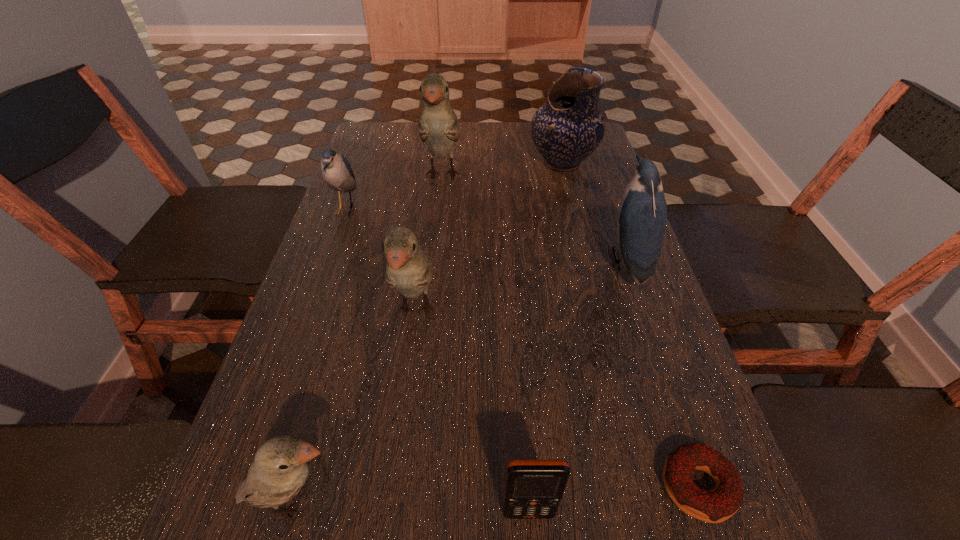
At what (x,y) coordinates should I click in order to perform the action: click on free spot between the fifth object from left to right and the tallest object. Please return your answer as a coordinate pair (x, y). This screenshot has width=960, height=540. Looking at the image, I should click on (486, 343).

Find the location of a particular element. The image size is (960, 540). unoccupied area between the second farthest white bird and the cellular telephone is located at coordinates (472, 411).

Point out which object is positioned as the nearest to the shortest object. Please provide its 2D coordinates. Your answer should be formatted as a tuple, i.e. [(x, y)], where the tuple contains the x and y coordinates of a point satisfying the conditions above.

[(534, 487)]

Where is `object that stands as the sixth closest to the nearest white bird`? The image size is (960, 540). object that stands as the sixth closest to the nearest white bird is located at coordinates (438, 127).

You are a GUI agent. You are given a task and a screenshot of the screen. Output one action in this format:
    pyautogui.click(x=<x>, y=<y>)
    Task: Click on the bird that is the third closest to the pottery
    This screenshot has height=540, width=960.
    Given the screenshot: What is the action you would take?
    pyautogui.click(x=409, y=269)

Identify the location of the second closest bird to the smallest white bird. This screenshot has height=540, width=960. (337, 172).

The image size is (960, 540). Identify the location of the third closest white bird to the left blue bird. (280, 468).

Select which white bird appears as the second closest to the shortest object. Please provide its 2D coordinates. Your answer should be formatted as a tuple, i.e. [(x, y)], where the tuple contains the x and y coordinates of a point satisfying the conditions above.

[(280, 468)]

The image size is (960, 540). I want to click on blank area in the image that satisfies the following two spatial constraints: 1. at the face of the second biggest white bird; 2. on the right side of the chocolate doughnut, so click(392, 487).

Locate an element on the screen. This screenshot has height=540, width=960. blank space that satisfies the following two spatial constraints: 1. on the back side of the shortest object; 2. at the tip of the farther blue bird's beak is located at coordinates (605, 209).